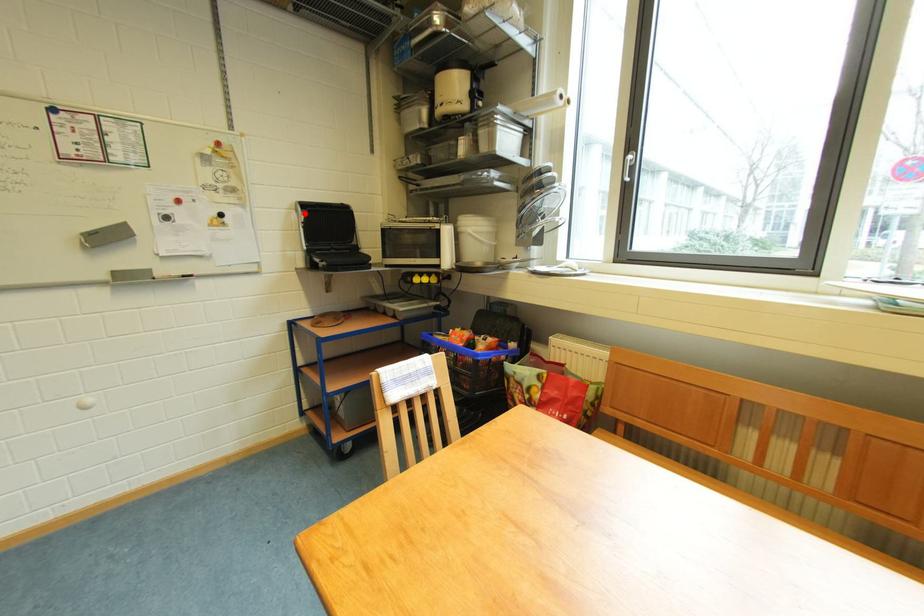
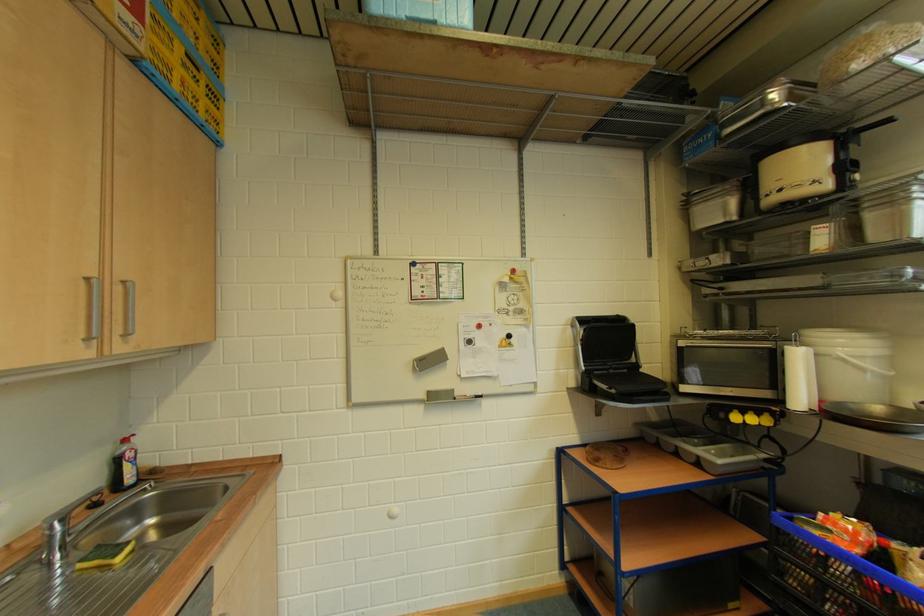
Find the pixel in the second image that matches the highlighted location in the first image.

(579, 329)